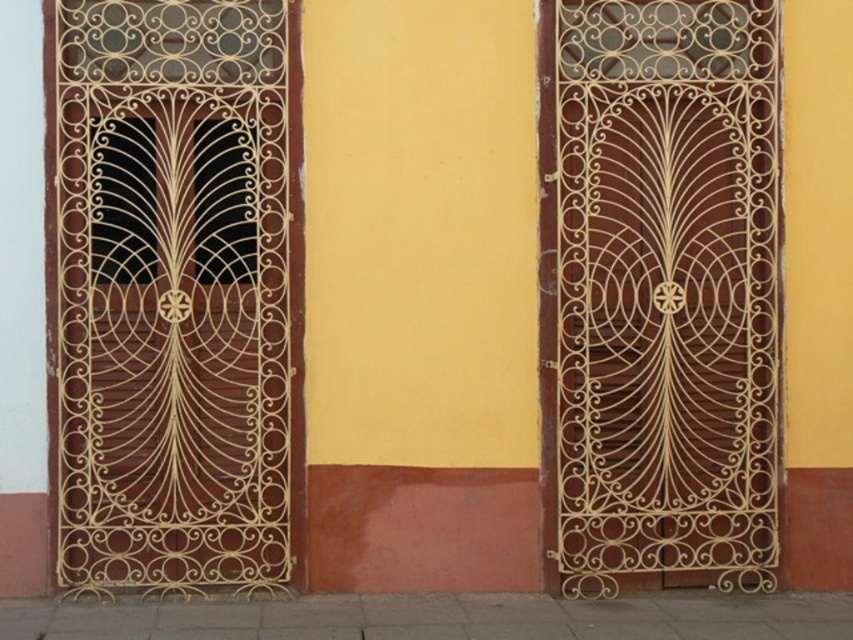
Can you confirm if gold wrought iron door at left is taller than brown wood door at center?

No.

Which is behind, point (283, 140) or point (674, 131)?

Positioned behind is point (674, 131).

The height and width of the screenshot is (640, 853). Identify the location of gold wrought iron door at left. [177, 292].